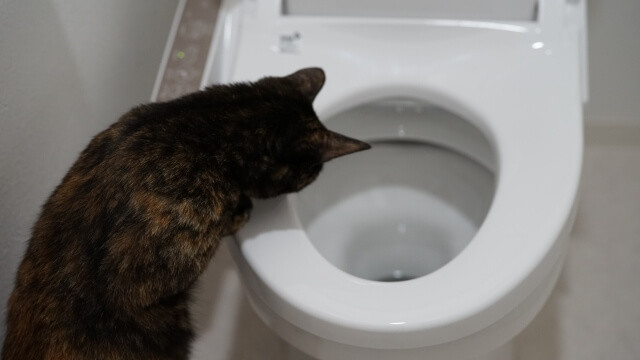
At what (x,y) coordinates should I click in order to perform the action: click on toilet. Please return your answer as a coordinate pair (x, y). The width and height of the screenshot is (640, 360). Looking at the image, I should click on (330, 301).